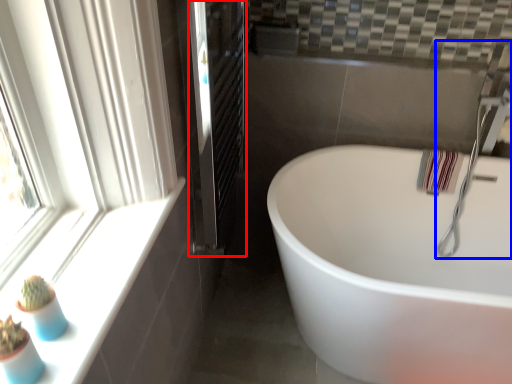
Question: Which object appears farthest to the camera in this image, screen door (highlighted by a red box) or faucet (highlighted by a blue box)?

Choices:
 (A) screen door
 (B) faucet

Answer: (B)